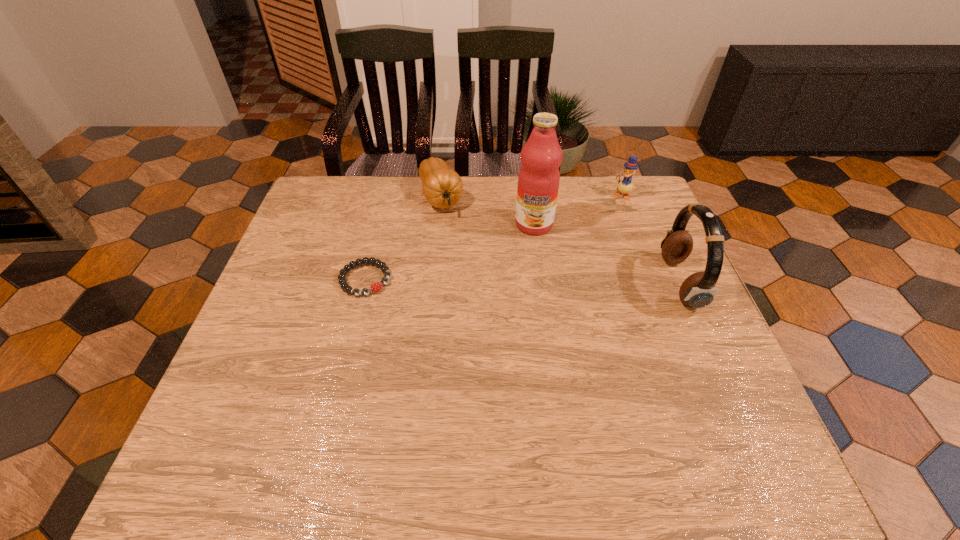
Locate an element on the screen. vacant spot on the desktop that is between the leftmost object and the second tallest object and is positioned on the label of the tallest object is located at coordinates (520, 281).

I want to click on vacant space on the desktop that is between the leftmost object and the fourth shortest object and is positioned on the face of the duckling, where the monocle is placed, so click(551, 281).

The height and width of the screenshot is (540, 960). Identify the location of vacant spot on the desktop that is between the shortest object and the fourth shortest object and is positioned on the stem side of the gourd. [479, 280].